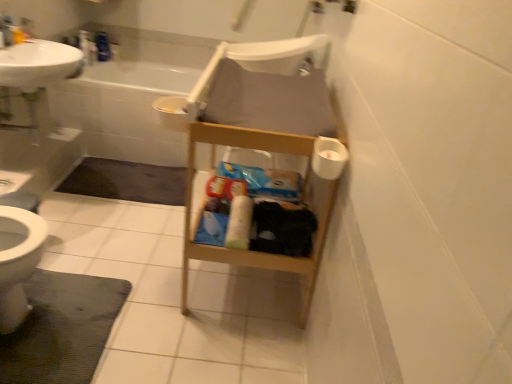
Find the location of a particular element. The width and height of the screenshot is (512, 384). free space to the right of dark gray textured bath mat at lower left, the 1th bath mat when ordered from front to back is located at coordinates (176, 322).